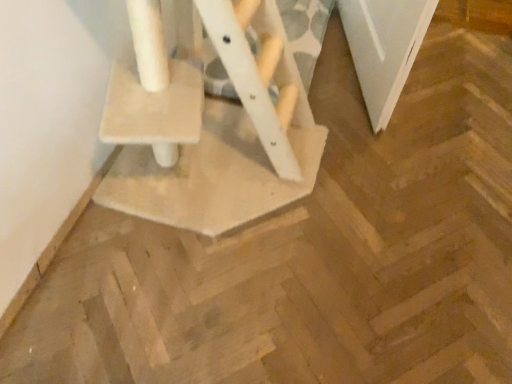
Where is `free point below beige textured cat tree at center (from a real-world perspective)`? The width and height of the screenshot is (512, 384). free point below beige textured cat tree at center (from a real-world perspective) is located at coordinates (222, 169).